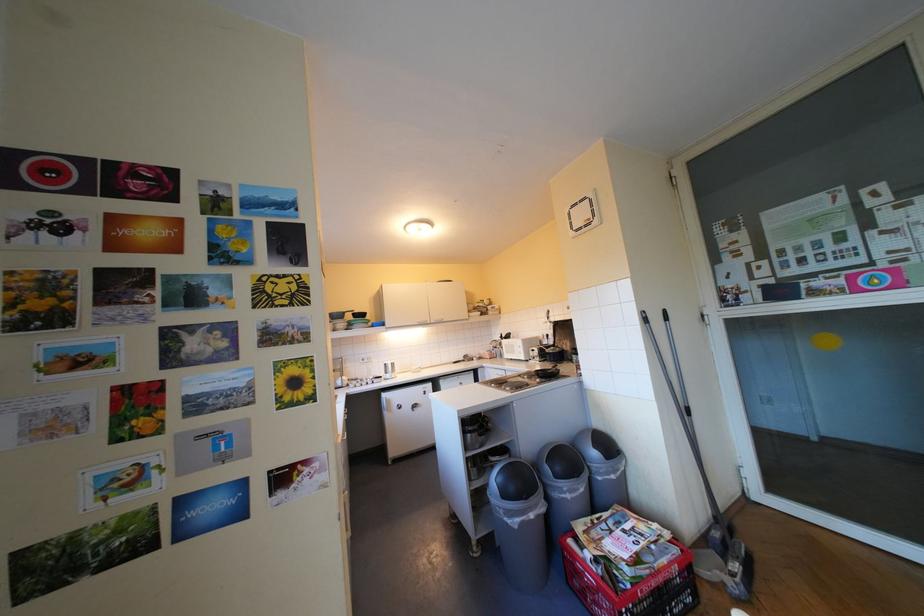
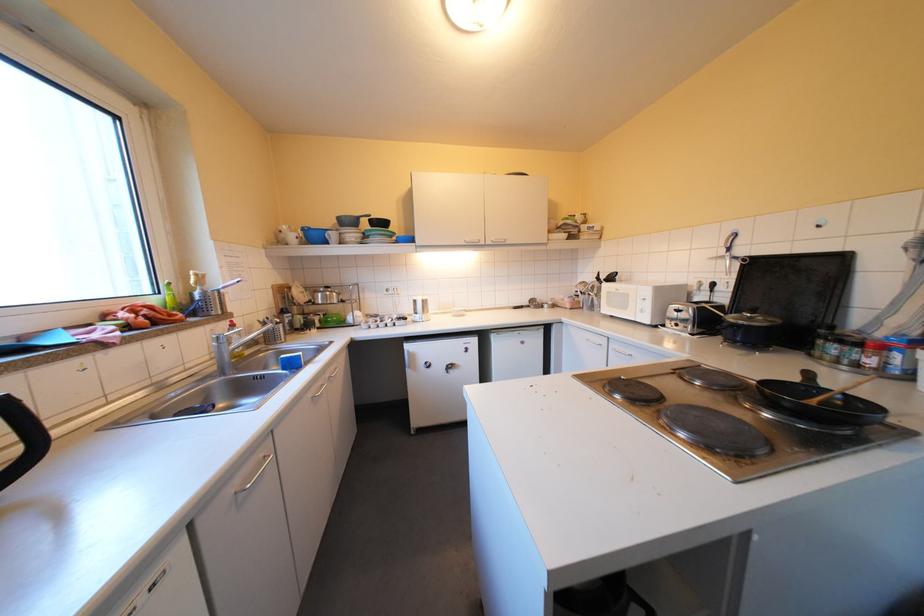
Locate, in the second image, the point that corresponds to [558,315] in the first image.

(736, 243)